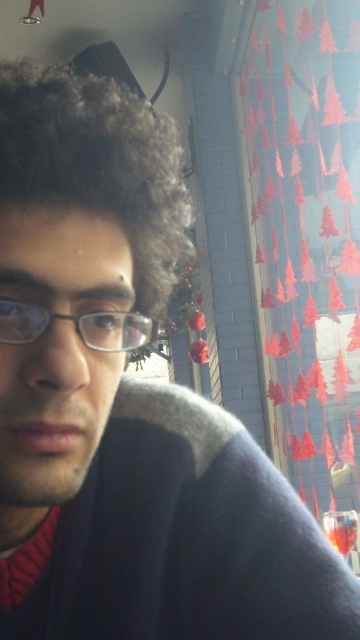
You are an artist sketching this scene and need to place the fuzzy brown hair at upper left precisely. What are the coordinates where you should position it?

The fuzzy brown hair at upper left should be positioned at coordinates point (97,164).

Looking at the person in the image, which object is larger between the fuzzy brown hair at upper left and the matte black glasses at center?

The fuzzy brown hair at upper left is bigger than the matte black glasses at center.

You are a photographer adjusting your camera settings to capture a clear shot of the fuzzy brown hair at upper left. If your camera has a minimum focusing distance of 12 inches, will you need to move closer or farther away to ensure the hair is in focus?

The fuzzy brown hair at upper left is currently 12.84 inches from the camera. Since the minimum focusing distance is 12 inches, you need to move slightly closer to reduce the distance below 12 inches for proper focus.